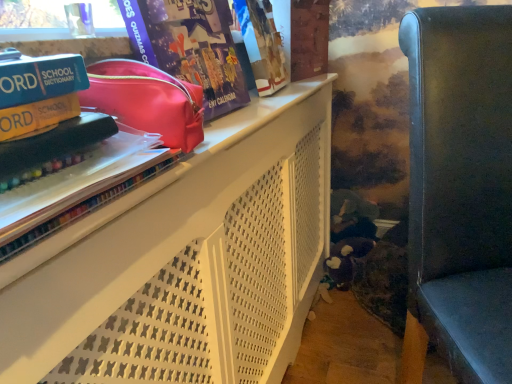
Question: From their relative heights in the image, would you say metallic gray chair at right is taller or shorter than shiny pink pouch at upper center?

Choices:
 (A) tall
 (B) short

Answer: (A)

Question: From the image's perspective, is metallic gray chair at right positioned above or below shiny pink pouch at upper center?

Choices:
 (A) below
 (B) above

Answer: (A)

Question: Considering the real-world distances, which object is closest to the shiny pink pouch at upper center?

Choices:
 (A) yellow matte paperback book at upper left, which ranks as the 2th paperback book in top-to-bottom order
 (B) white matte shelf at upper left
 (C) matte purple comic book at upper left
 (D) metallic gray chair at right
 (E) teal matte school dictionary at upper left, which is the second paperback book in bottom-to-top order

Answer: (E)

Question: Estimate the real-world distances between objects in this image. Which object is closer to the yellow matte paperback book at upper left, which ranks as the 2th paperback book in top-to-bottom order?

Choices:
 (A) matte purple comic book at upper left
 (B) shiny pink pouch at upper center
 (C) translucent plastic book at upper left
 (D) metallic gray chair at right
 (E) teal matte school dictionary at upper left, which is the second paperback book in bottom-to-top order

Answer: (E)